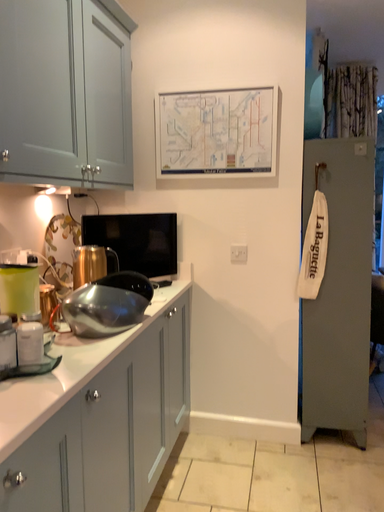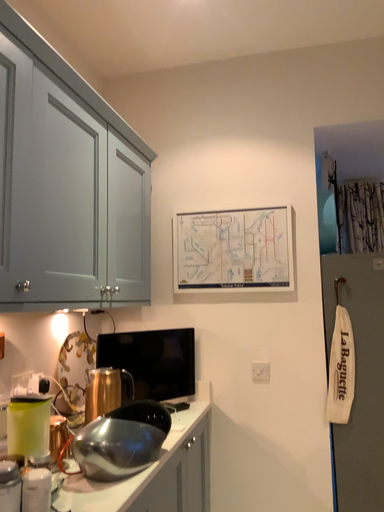
Question: How did the camera likely rotate when shooting the video?

Choices:
 (A) rotated upward
 (B) rotated downward

Answer: (A)